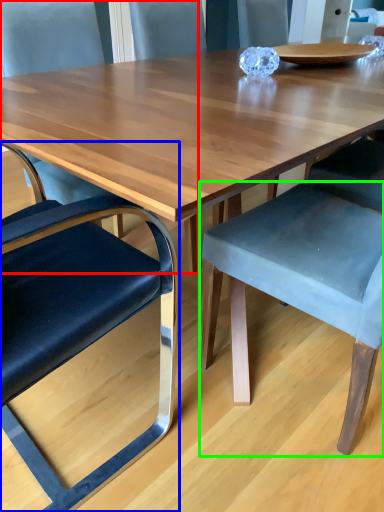
Question: Which is farther away from chair (highlighted by a red box)? chair (highlighted by a blue box) or chair (highlighted by a green box)?

Choices:
 (A) chair
 (B) chair

Answer: (B)